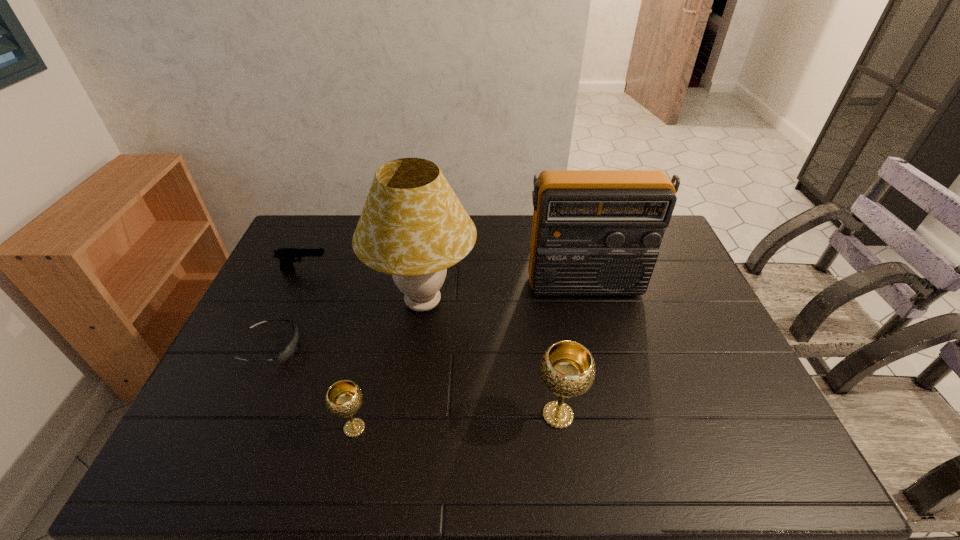
In order to click on free space between the shorter chalice and the goggles in this screenshot , I will do `click(313, 388)`.

This screenshot has width=960, height=540. I want to click on object that can be found as the third closest to the lampshade, so click(287, 256).

Locate which object is the fifth closest to the radio receiver. Please provide its 2D coordinates. Your answer should be formatted as a tuple, i.e. [(x, y)], where the tuple contains the x and y coordinates of a point satisfying the conditions above.

[(288, 351)]

Where is `vacant space that satisfies the following two spatial constraints: 1. on the lenses of the fourth tallest object; 2. on the left side of the goggles`? This screenshot has height=540, width=960. vacant space that satisfies the following two spatial constraints: 1. on the lenses of the fourth tallest object; 2. on the left side of the goggles is located at coordinates (236, 428).

Locate an element on the screen. free spot that satisfies the following two spatial constraints: 1. on the front-facing side of the radio receiver; 2. on the lenses of the shortest object is located at coordinates (600, 347).

Find the location of `blank area in the image that satisfies the following two spatial constraints: 1. on the lenses of the third tallest object; 2. on the right side of the goggles`. blank area in the image that satisfies the following two spatial constraints: 1. on the lenses of the third tallest object; 2. on the right side of the goggles is located at coordinates (242, 415).

Where is `vacant area in the image that satisfies the following two spatial constraints: 1. on the back side of the right chalice; 2. on the front-facing side of the pistol`? Image resolution: width=960 pixels, height=540 pixels. vacant area in the image that satisfies the following two spatial constraints: 1. on the back side of the right chalice; 2. on the front-facing side of the pistol is located at coordinates (537, 270).

At what (x,y) coordinates should I click in order to perform the action: click on vacant space that satisfies the following two spatial constraints: 1. on the front-facing side of the radio receiver; 2. on the lenses of the goggles. Please return your answer as a coordinate pair (x, y). The height and width of the screenshot is (540, 960). Looking at the image, I should click on (600, 347).